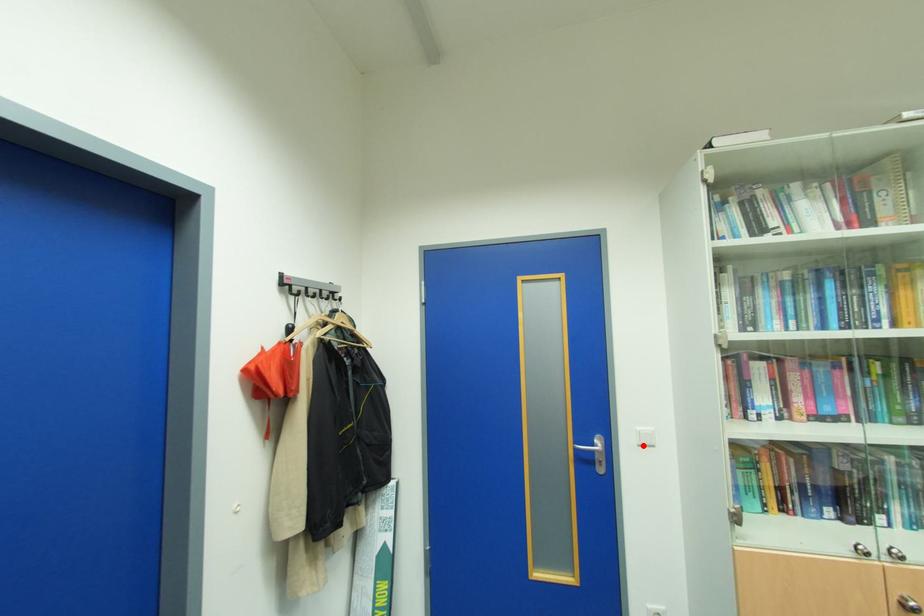
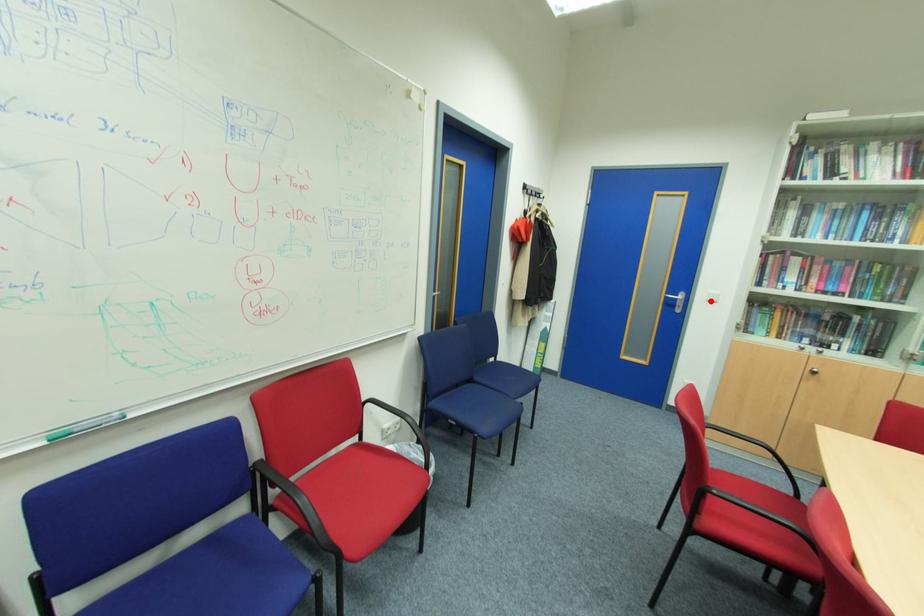
I am providing you with two images of the same scene from different viewpoints. A red point is marked on the first image and another point is marked on the second image. Is the red point in image1 aligned with the point shown in image2?

Yes